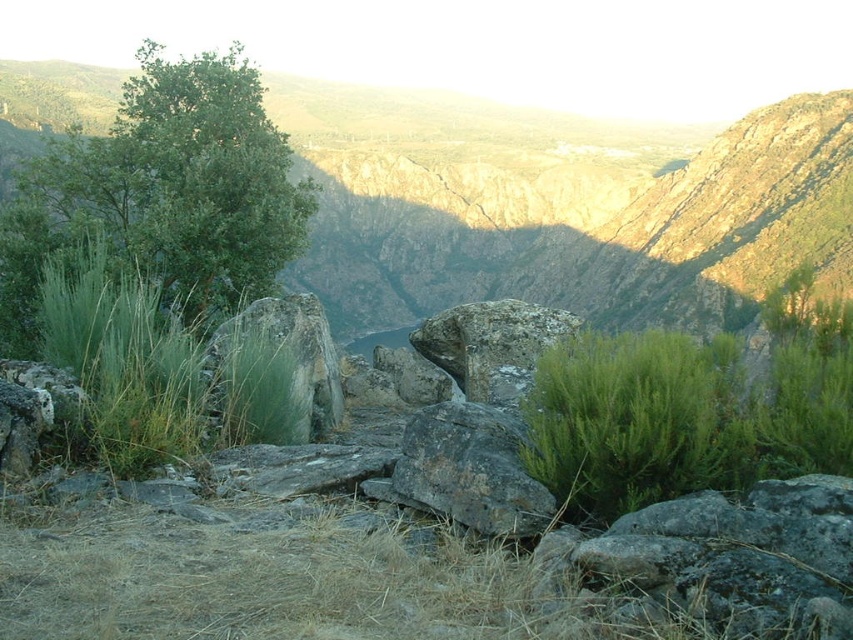
You are standing at the center of the rocky terrain and want to head towards the green leafy tree at upper left. Which direction should you move in to reach it?

The green leafy tree at upper left is located at point coordinates, so you should move towards the upper left direction to reach it.

You are a hiker planning to climb the rocky cliff at center and the rough textured rock at center. Based on their positions, which one should you attempt first?

Since the rocky cliff at center is in front of the rough textured rock at center, you should attempt the rocky cliff at center first before moving to the rough textured rock at center which is behind it.

You are a hiker trying to navigate through the rocky terrain. You see the green leafy tree at upper left and the green rough rock at left. Which object is closer to you, the hiker?

The green leafy tree at upper left is closer to you since it is further to the viewer than the green rough rock at left, meaning it appears nearer in the scene.